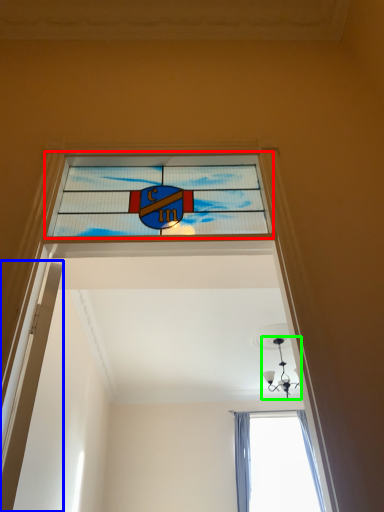
Question: Which object is positioned farthest from window (highlighted by a red box)? Select from door (highlighted by a blue box) and light fixture (highlighted by a green box).

Choices:
 (A) door
 (B) light fixture

Answer: (B)